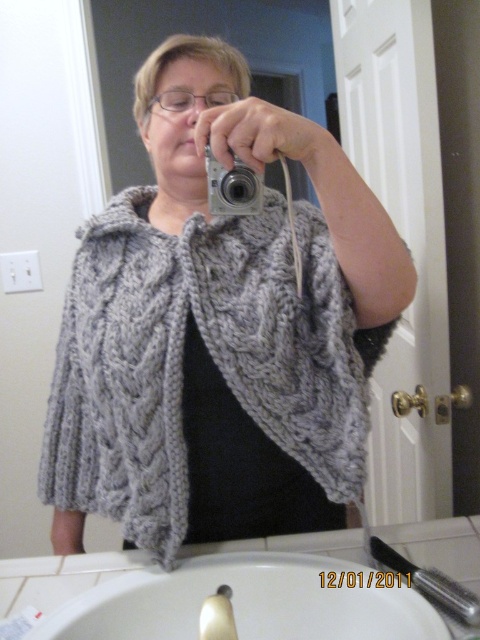
You are standing in the bathroom and see two points marked in the scene. One is at coordinates point (66, 426) and the other is at point (251, 204). Which point is closer to you?

Point (66, 426) is further to the viewer than point (251, 204), so the point at (251, 204) is closer to you.

In the scene shown: You are a photographer trying to capture the reflection in the mirror. The white ceramic sink at lower center and the silver metallic camera at center are both in your view. Which object would block your view of the mirror if placed closer to you?

The white ceramic sink at lower center would block your view of the mirror because it is larger in size than the silver metallic camera at center, making it more likely to obstruct the line of sight when positioned closer.